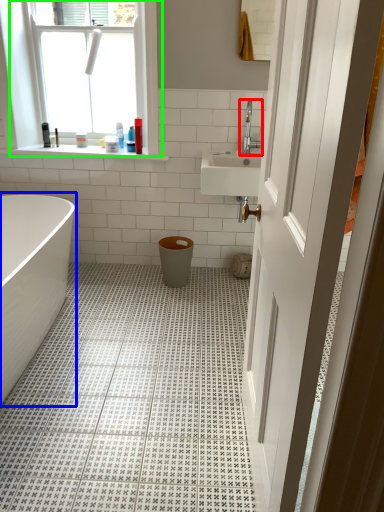
Question: Which object is positioned farthest from tap (highlighted by a red box)? Select from bathtub (highlighted by a blue box) and window (highlighted by a green box).

Choices:
 (A) bathtub
 (B) window

Answer: (A)